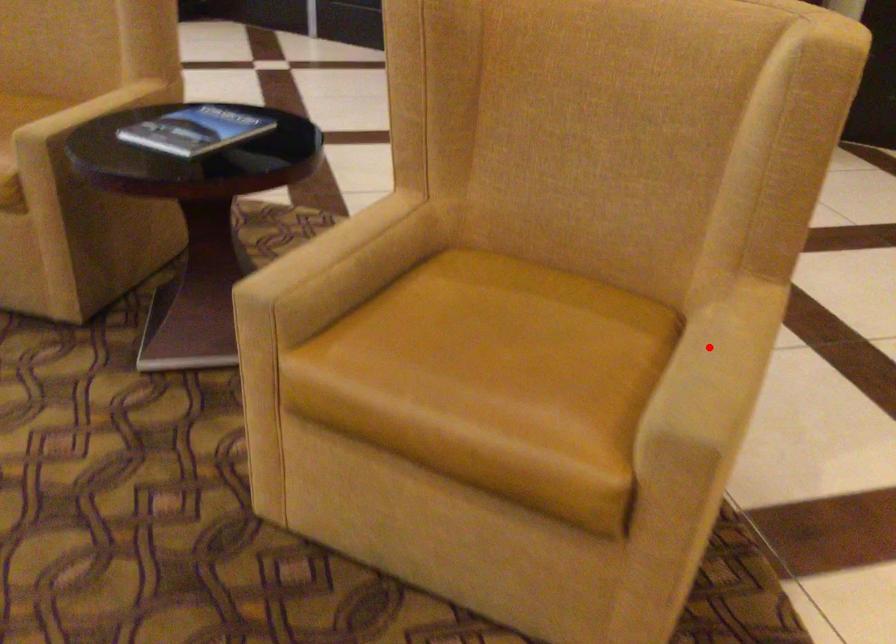
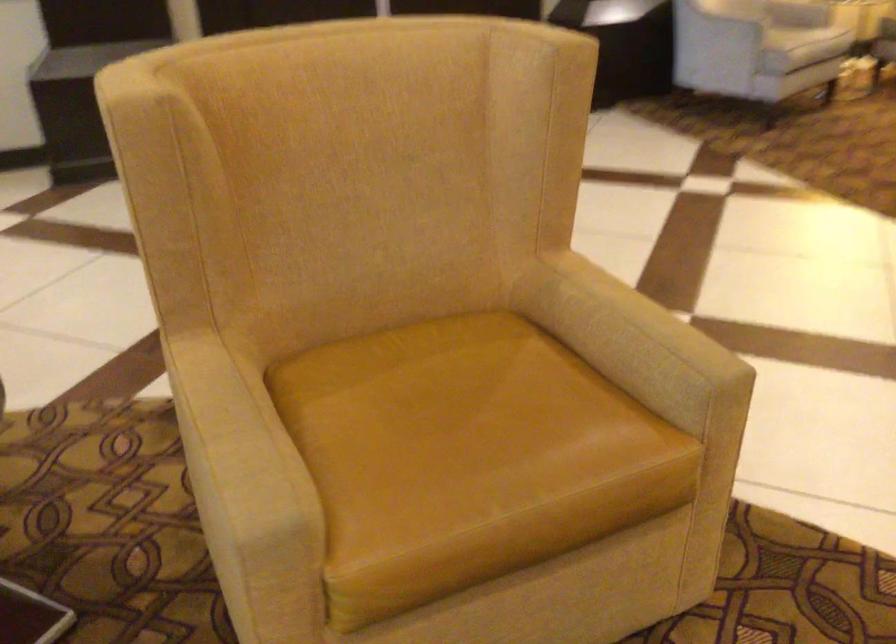
Find the pixel in the second image that matches the highlighted location in the first image.

(624, 322)